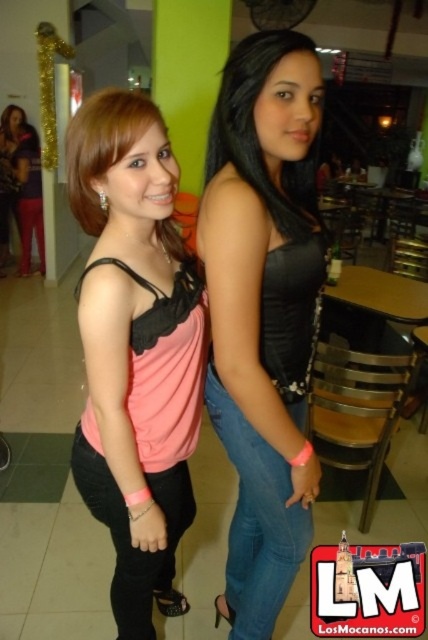
You are taking a photo of two people in a cafe. You notice two points in the image at coordinates point (x=158, y=556) and point (x=42, y=275). Which point is closer to your camera?

Point (x=158, y=556) is closer to the camera than point (x=42, y=275).